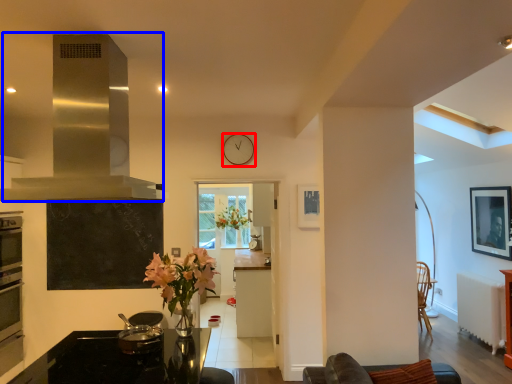
Question: Among these objects, which one is nearest to the camera, clock (highlighted by a red box) or exhaust hood (highlighted by a blue box)?

Choices:
 (A) clock
 (B) exhaust hood

Answer: (B)